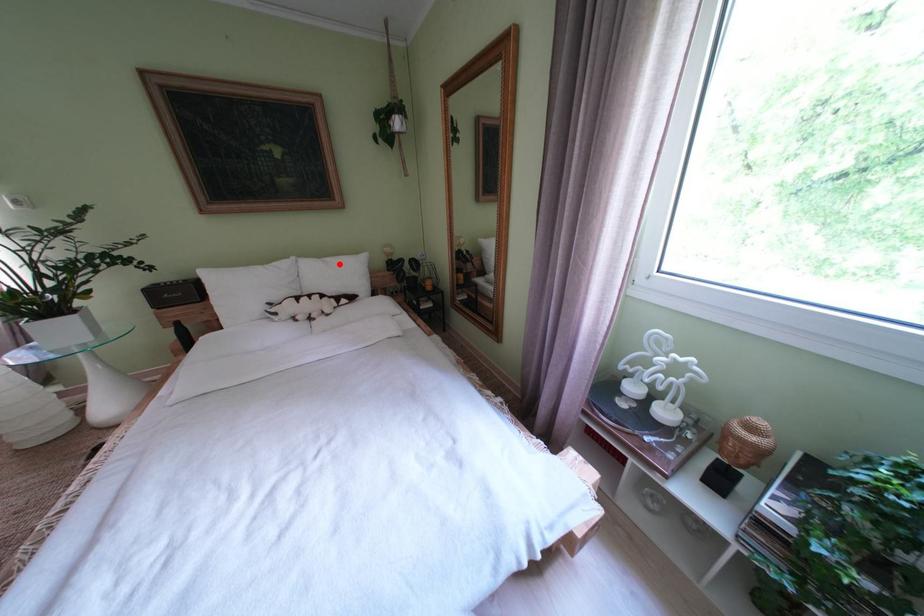
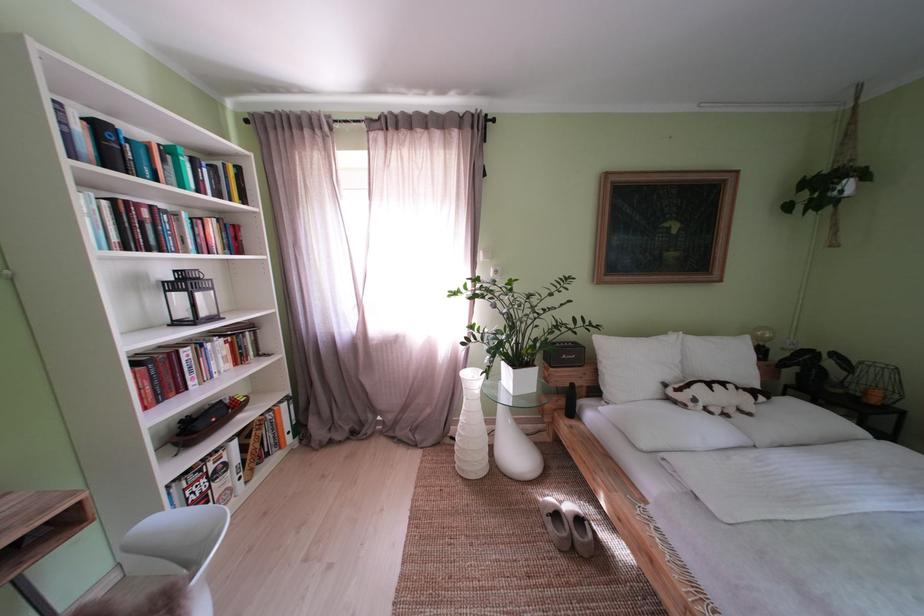
Question: I am providing you with two images of the same scene from different viewpoints. Image1 has a red point marked. In image2, the corresponding 3D location appears at what relative position? Reply with the corresponding letter.

Choices:
 (A) Closer
 (B) Farther

Answer: (B)